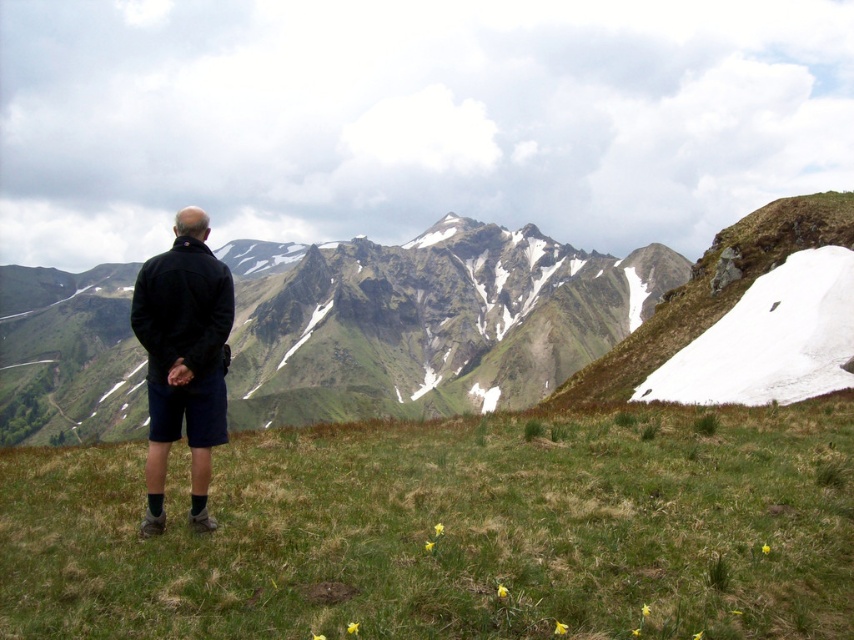
Question: Which is nearer to the black matte jacket at center?

Choices:
 (A) green grassy mountain at center
 (B) green grassy at center

Answer: (B)

Question: Which of these objects is positioned farthest from the green grassy at center?

Choices:
 (A) green grassy mountain at center
 (B) black matte jacket at center

Answer: (A)

Question: From the image, what is the correct spatial relationship of green grassy at center in relation to black matte jacket at center?

Choices:
 (A) below
 (B) above

Answer: (A)

Question: Among these points, which one is farthest from the camera?

Choices:
 (A) (335, 266)
 (B) (153, 464)
 (C) (461, 522)

Answer: (A)

Question: In this image, where is green grassy mountain at center located relative to black matte jacket at center?

Choices:
 (A) left
 (B) right

Answer: (A)

Question: Is green grassy at center wider than black matte jacket at center?

Choices:
 (A) yes
 (B) no

Answer: (A)